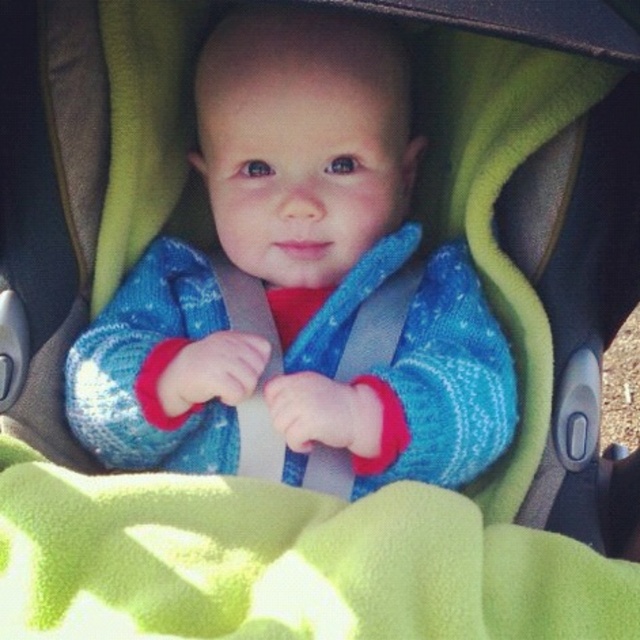
The baby is wearing a blue knitted sweater at center. Is the sweater covering the baby more than half of the baby?

The blue knitted sweater at center is located at point (300, 285), but without knowing the baby size and the sweater size, it is impossible to determine if it covers more than half the baby.

You are a parent preparing to dress your baby for an outdoor walk. You have a blue knitted sweater at center and a green fleece blanket at center. Which item should you put on first to ensure proper layering?

The blue knitted sweater at center should be put on first since it is larger in size than the green fleece blanket at center, allowing the blanket to be placed over it for added warmth.

You are a photographer standing 3 feet away from the baby in the stroller. You want to take a closeup photo of the blue knitted sweater at center. Can you get a clear closeup without moving closer than 3 feet?

The blue knitted sweater at center and camera are 34.98 inches apart, which is approximately 2.915 feet. Since you are standing exactly 3 feet away, you can get a clear closeup without moving closer than 3 feet.